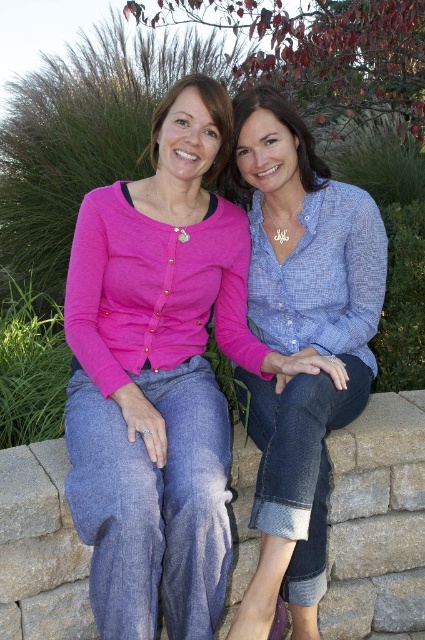
Question: Is matte pink sweater at center thinner than blue textured shirt at center?

Choices:
 (A) yes
 (B) no

Answer: (B)

Question: Which point is closer to the camera taking this photo?

Choices:
 (A) (252, 435)
 (B) (161, 445)

Answer: (B)

Question: From the image, what is the correct spatial relationship of matte pink sweater at center in relation to blue textured shirt at center?

Choices:
 (A) below
 (B) above

Answer: (B)

Question: Can you confirm if matte pink sweater at center is positioned above blue textured shirt at center?

Choices:
 (A) yes
 (B) no

Answer: (A)

Question: Among these objects, which one is farthest from the camera?

Choices:
 (A) matte pink sweater at center
 (B) blue textured shirt at center

Answer: (B)